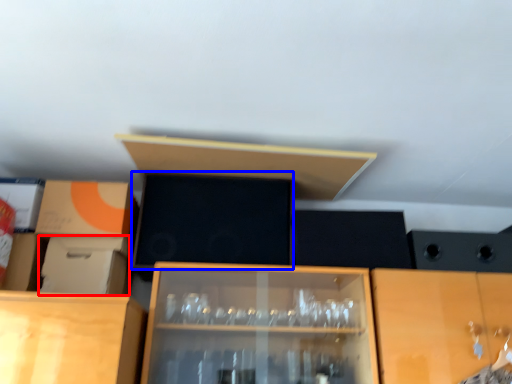
Question: Among these objects, which one is nearest to the camera, cardboard box (highlighted by a red box) or box (highlighted by a blue box)?

Choices:
 (A) cardboard box
 (B) box

Answer: (A)